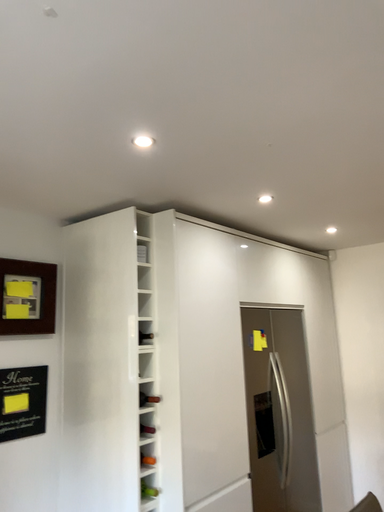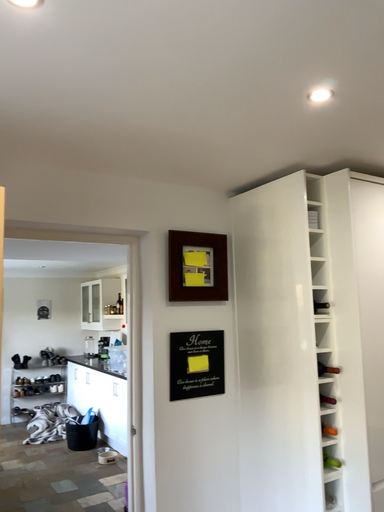
Question: Which way did the camera rotate in the video?

Choices:
 (A) rotated left
 (B) rotated right

Answer: (A)